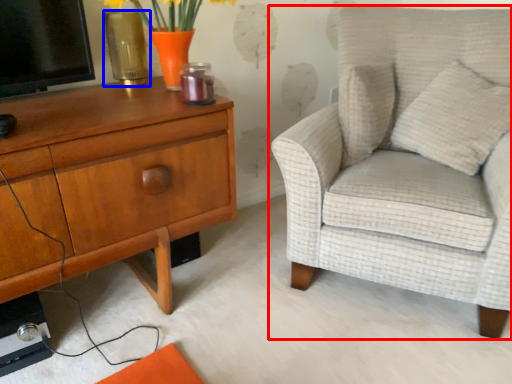
Question: Which object is closer to the camera taking this photo, chair (highlighted by a red box) or vase (highlighted by a blue box)?

Choices:
 (A) chair
 (B) vase

Answer: (A)